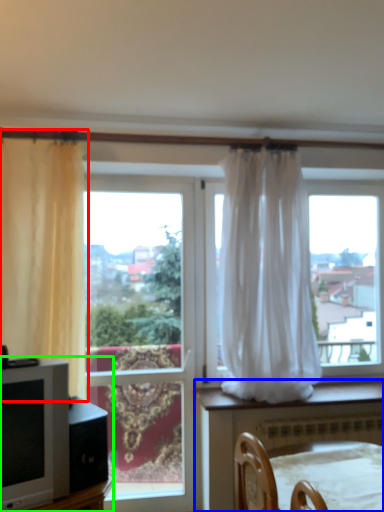
Question: Estimate the real-world distances between objects in this image. Which object is farther from curtain (highlighted by a red box), furniture (highlighted by a blue box) or entertainment center (highlighted by a green box)?

Choices:
 (A) furniture
 (B) entertainment center

Answer: (A)